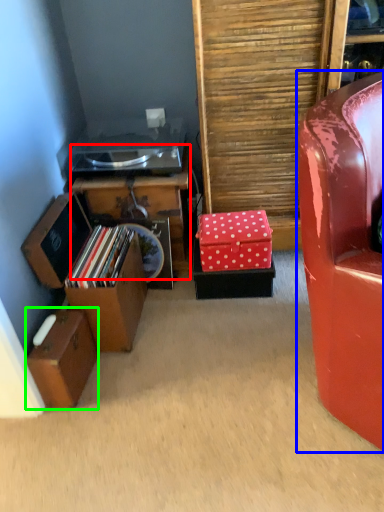
Question: Which is nearer to the furniture (highlighted by a red box)? chair (highlighted by a blue box) or storage box (highlighted by a green box).

Choices:
 (A) chair
 (B) storage box

Answer: (B)